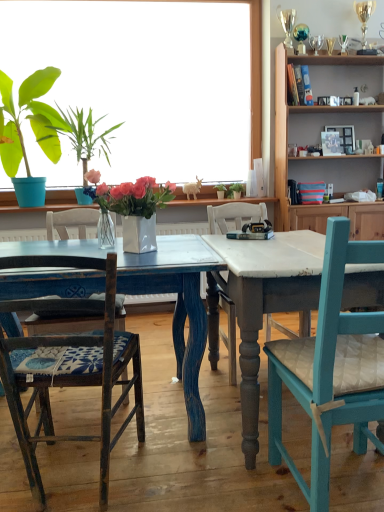
Question: Which direction should I rotate to face green leafy plant at center, placed as the fifth houseplant when sorted from left to right, — up or down?

Choices:
 (A) down
 (B) up

Answer: (B)

Question: Does wooden cabinet at upper right have a lesser height compared to green matte plant pot at center, the 4th houseplant when ordered from left to right?

Choices:
 (A) yes
 (B) no

Answer: (B)

Question: Is wooden cabinet at upper right outside of green matte plant pot at center, which ranks as the second houseplant in back-to-front order?

Choices:
 (A) yes
 (B) no

Answer: (A)

Question: Is wooden cabinet at upper right aimed at green matte plant pot at center, the 4th houseplant when ordered from left to right?

Choices:
 (A) yes
 (B) no

Answer: (B)

Question: Is wooden cabinet at upper right turned away from green matte plant pot at center, which ranks as the second houseplant in right-to-left order?

Choices:
 (A) yes
 (B) no

Answer: (B)

Question: From a real-world perspective, is wooden cabinet at upper right on top of green matte plant pot at center, which appears as the 4th houseplant when viewed from the front?

Choices:
 (A) yes
 (B) no

Answer: (A)

Question: From the image's perspective, is wooden cabinet at upper right above green matte plant pot at center, which ranks as the second houseplant in back-to-front order?

Choices:
 (A) yes
 (B) no

Answer: (A)

Question: Is wooden cabinet at upper right looking in the opposite direction of white glossy vase at center, arranged as the 3th houseplant when viewed from the left?

Choices:
 (A) yes
 (B) no

Answer: (B)

Question: From the image's perspective, would you say wooden cabinet at upper right is shown under white glossy vase at center, which appears as the fifth houseplant when viewed from the back?

Choices:
 (A) yes
 (B) no

Answer: (B)

Question: Is wooden cabinet at upper right positioned before white glossy vase at center, which appears as the fifth houseplant when viewed from the back?

Choices:
 (A) no
 (B) yes

Answer: (A)

Question: From the image's perspective, is wooden cabinet at upper right over white glossy vase at center, arranged as the 3th houseplant when viewed from the left?

Choices:
 (A) yes
 (B) no

Answer: (A)

Question: Can you confirm if wooden cabinet at upper right is bigger than white glossy vase at center, which appears as the fifth houseplant when viewed from the back?

Choices:
 (A) no
 (B) yes

Answer: (B)

Question: From a real-world perspective, is wooden cabinet at upper right under white glossy vase at center, which appears as the fifth houseplant when viewed from the back?

Choices:
 (A) yes
 (B) no

Answer: (B)

Question: Is wooden cabinet at upper right oriented towards distressed blue wood table at center?

Choices:
 (A) yes
 (B) no

Answer: (B)